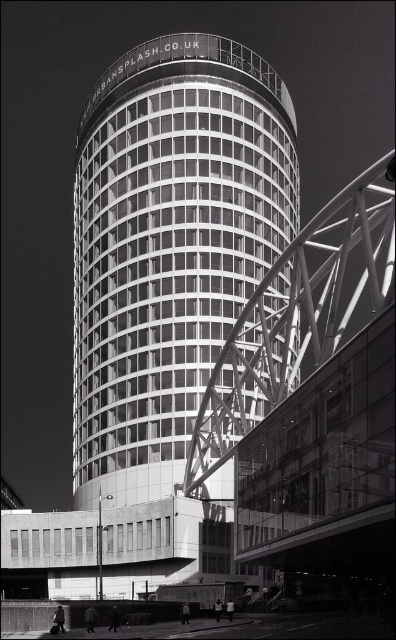
Question: Which object is closer to the camera taking this photo?

Choices:
 (A) metallic gray bridge at center-right
 (B) smooth glass tower at center

Answer: (A)

Question: Does smooth glass tower at center have a lesser width compared to metallic gray bridge at center-right?

Choices:
 (A) no
 (B) yes

Answer: (A)

Question: Can you confirm if smooth glass tower at center is bigger than metallic gray bridge at center-right?

Choices:
 (A) yes
 (B) no

Answer: (A)

Question: Which of the following is the closest to the observer?

Choices:
 (A) (298, 308)
 (B) (142, 316)

Answer: (A)

Question: Observing the image, what is the correct spatial positioning of smooth glass tower at center in reference to metallic gray bridge at center-right?

Choices:
 (A) above
 (B) below

Answer: (B)